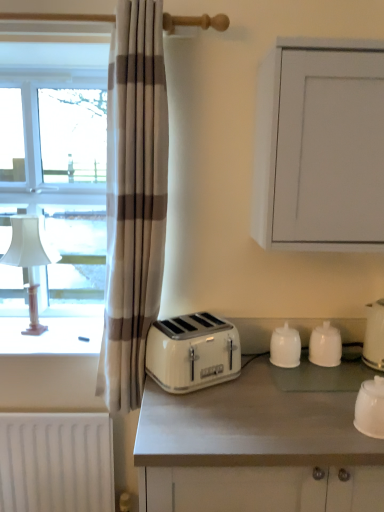
Question: Could you tell me if white glossy cup at lower right, which is the 1th kitchen appliance from front to back, is turned towards white plastic toaster at center?

Choices:
 (A) yes
 (B) no

Answer: (B)

Question: Does white glossy cup at lower right, which ranks as the 2th kitchen appliance in right-to-left order, appear on the left side of white plastic toaster at center?

Choices:
 (A) no
 (B) yes

Answer: (A)

Question: Is white glossy cup at lower right, which is the 1th kitchen appliance from front to back, shorter than white plastic toaster at center?

Choices:
 (A) no
 (B) yes

Answer: (B)

Question: Can you see white glossy cup at lower right, which appears as the third kitchen appliance when viewed from the left, touching white plastic toaster at center?

Choices:
 (A) no
 (B) yes

Answer: (A)

Question: From a real-world perspective, is white glossy cup at lower right, which ranks as the 2th kitchen appliance in right-to-left order, on top of white plastic toaster at center?

Choices:
 (A) no
 (B) yes

Answer: (A)

Question: Is white plastic toaster at center surrounded by white glossy cup at lower right, which appears as the third kitchen appliance when viewed from the left?

Choices:
 (A) no
 (B) yes

Answer: (A)

Question: Does beige striped curtain at left have a lesser height compared to white glossy table lamp at left?

Choices:
 (A) yes
 (B) no

Answer: (B)

Question: From the image's perspective, is beige striped curtain at left on top of white glossy table lamp at left?

Choices:
 (A) no
 (B) yes

Answer: (B)

Question: Could you tell me if beige striped curtain at left is turned towards white glossy table lamp at left?

Choices:
 (A) yes
 (B) no

Answer: (B)

Question: Is white glossy table lamp at left inside beige striped curtain at left?

Choices:
 (A) yes
 (B) no

Answer: (B)

Question: Considering the relative sizes of beige striped curtain at left and white glossy table lamp at left in the image provided, is beige striped curtain at left wider than white glossy table lamp at left?

Choices:
 (A) yes
 (B) no

Answer: (A)

Question: From the image's perspective, is beige striped curtain at left beneath white glossy table lamp at left?

Choices:
 (A) no
 (B) yes

Answer: (A)

Question: Considering the relative sizes of beige striped curtain at left and white matte countertop at center in the image provided, is beige striped curtain at left smaller than white matte countertop at center?

Choices:
 (A) yes
 (B) no

Answer: (A)